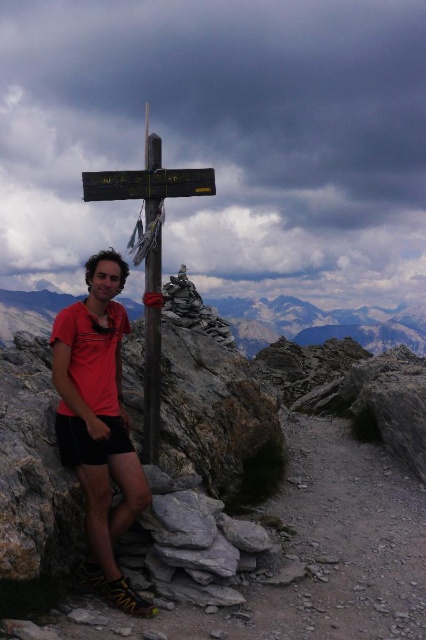
Question: Which is nearer to the wooden sign at center?

Choices:
 (A) rocky mountain at center
 (B) wooden pole at center

Answer: (B)

Question: Does matte red shirt at center come behind rocky mountain at center?

Choices:
 (A) no
 (B) yes

Answer: (A)

Question: Does matte red shirt at center lie in front of wooden sign at center?

Choices:
 (A) no
 (B) yes

Answer: (B)

Question: Does matte red shirt at center lie behind wooden sign at center?

Choices:
 (A) no
 (B) yes

Answer: (A)

Question: Which of the following is the closest to the observer?

Choices:
 (A) (150, 440)
 (B) (57, 416)
 (C) (95, 179)

Answer: (B)

Question: Estimate the real-world distances between objects in this image. Which object is farther from the rocky mountain at center?

Choices:
 (A) matte red shirt at center
 (B) wooden pole at center
 (C) wooden sign at center

Answer: (B)